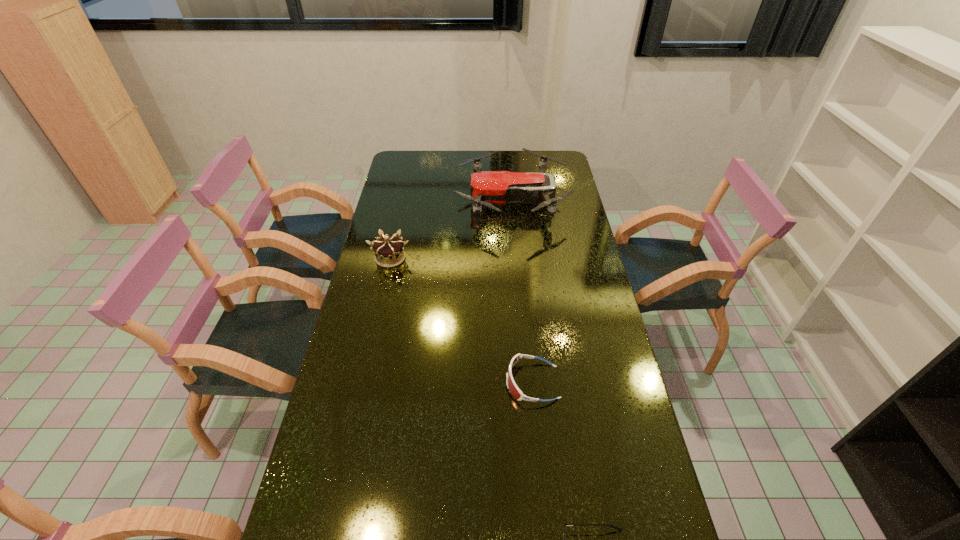
Where is `free space at the far left corner`? Image resolution: width=960 pixels, height=540 pixels. free space at the far left corner is located at coordinates (411, 171).

Locate an element on the screen. vacant space at the far right corner of the desktop is located at coordinates (569, 173).

Find the location of `empty location between the drone and the crown`. empty location between the drone and the crown is located at coordinates (451, 230).

You are a GUI agent. You are given a task and a screenshot of the screen. Output one action in this format:
    pyautogui.click(x=<x>, y=<y>)
    Task: Click on the unoccupied position between the drone and the second farthest object
    The width and height of the screenshot is (960, 540).
    Given the screenshot: What is the action you would take?
    pyautogui.click(x=451, y=230)

Locate an element on the screen. vacant space that is in between the tallest object and the leftmost object is located at coordinates (451, 230).

Locate an element on the screen. object that is the nearest to the farthest object is located at coordinates (389, 252).

Identify the location of object that stands as the second closest to the spectacles. (389, 252).